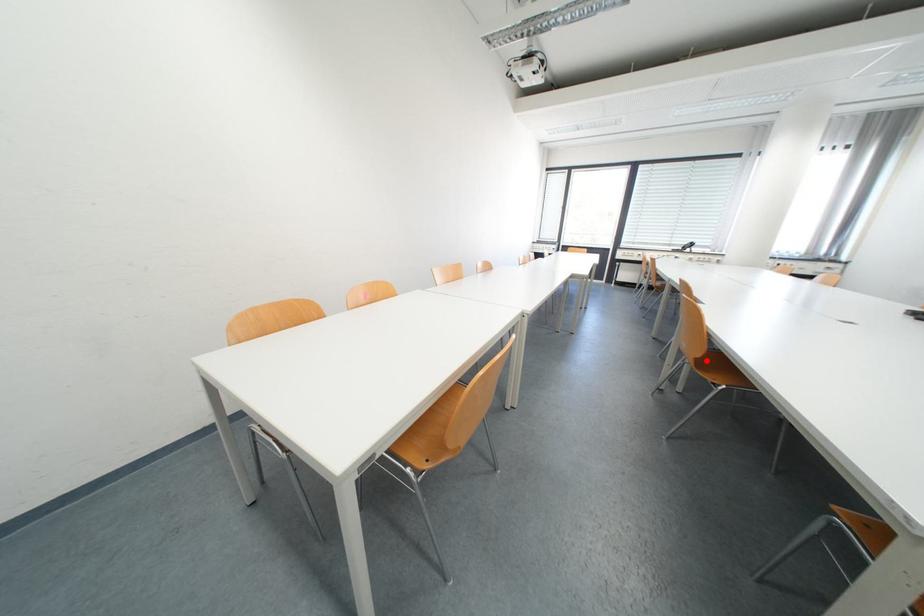
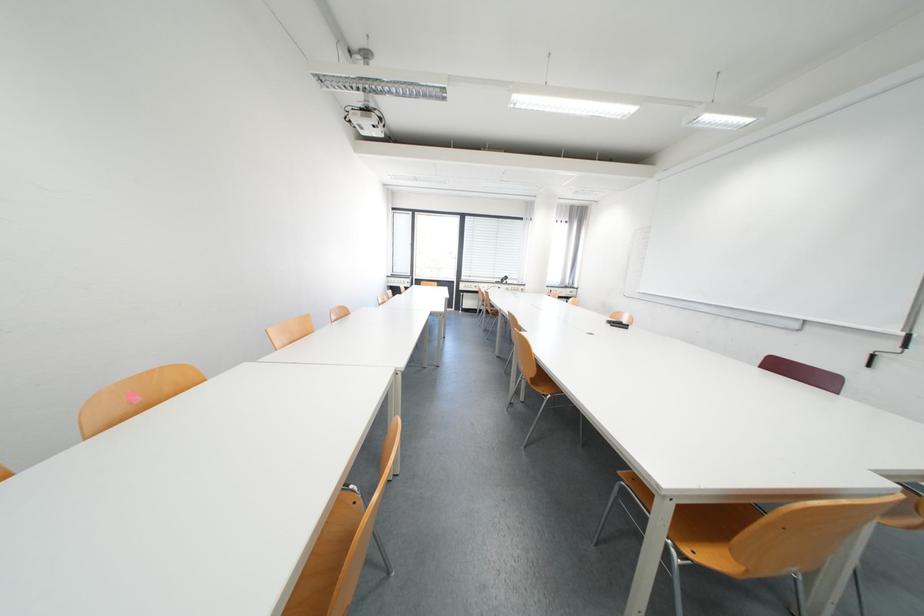
Question: A red point is marked in image1. In image2, is the corresponding 3D point closer to the camera or farther? Reply with the corresponding letter.

Choices:
 (A) The corresponding 3D point is closer.
 (B) The corresponding 3D point is farther.

Answer: (B)